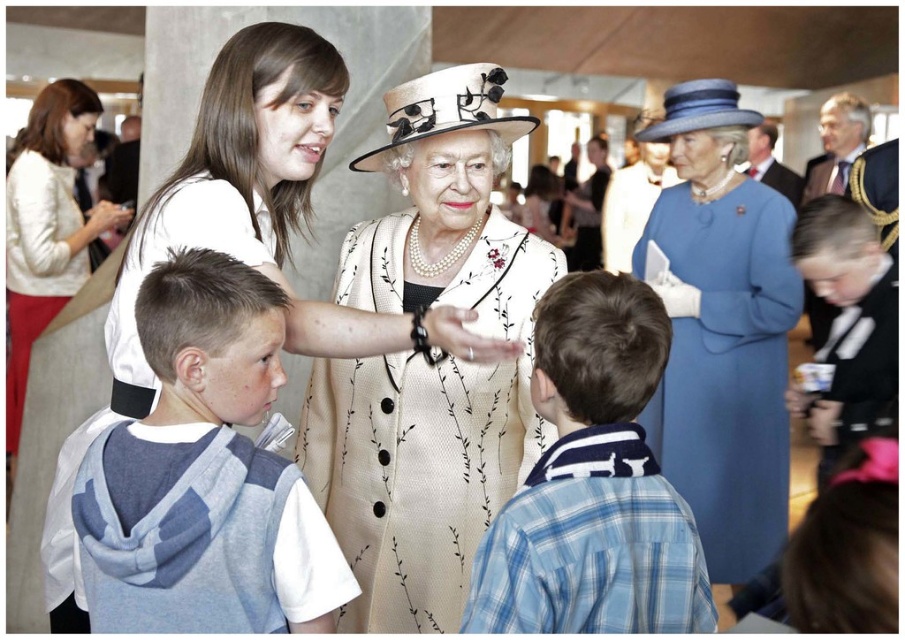
You are attending a formal event and see two guests dressed in the white textured sweater at upper left and the black satin suit at right. Which guest is positioned closer to the left side of the scene?

The white textured sweater at upper left is positioned to the left of the black satin suit at right, so the guest in the white textured sweater at upper left is closer to the left side of the scene.

You are standing at the entrance of the event and want to approach both the blue woolen dress at center and the black satin suit at right. Which one should you head towards first to reach the closer one?

The blue woolen dress at center is closer to you than the black satin suit at right, so you should head towards the blue woolen dress at center first.

Consider the image. You are organizing a photo shoot and need to place two outfits side by side on a mannequin stand. The stand can only accommodate items up to the width of the blue woolen dress at center. Will the black satin suit at right fit on the same stand without overlapping?

The blue woolen dress at center is wider than the black satin suit at right, so the stand can accommodate the black satin suit at right since its width is narrower than the dress.